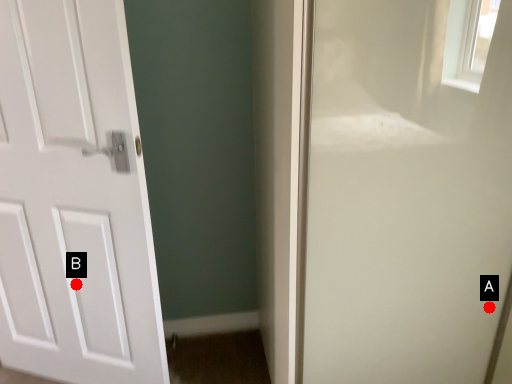
Question: Two points are circled on the image, labeled by A and B beside each circle. Which point appears farthest from the camera in this image?

Choices:
 (A) A is further
 (B) B is further

Answer: (B)